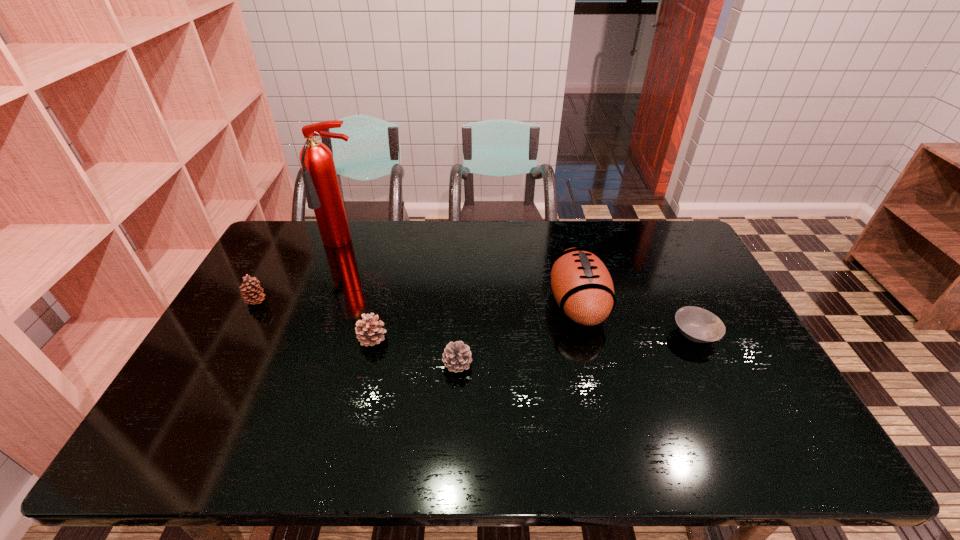
This screenshot has width=960, height=540. I want to click on object positioned at the right edge, so click(698, 325).

In the image, there is a desktop. Where is `vacant space at the far edge`? The image size is (960, 540). vacant space at the far edge is located at coordinates 552,246.

This screenshot has width=960, height=540. I want to click on vacant space at the near edge, so click(692, 437).

In the image, there is a desktop. Identify the location of free region at the left edge. [255, 314].

This screenshot has width=960, height=540. Identify the location of vacant space at the right edge. (678, 299).

The image size is (960, 540). In the image, there is a desktop. What are the coordinates of `vacant space at the far left corner` in the screenshot? It's located at (284, 244).

In the image, there is a desktop. Find the location of `vacant space at the far right corner`. vacant space at the far right corner is located at coordinates (667, 248).

The width and height of the screenshot is (960, 540). Identify the location of vacant space at the near right corner. (798, 448).

Locate an element on the screen. The width and height of the screenshot is (960, 540). free spot between the second nearest pinecone and the leftmost object is located at coordinates (314, 320).

Where is `empty space between the rightmost object and the football (American)`? The image size is (960, 540). empty space between the rightmost object and the football (American) is located at coordinates (636, 319).